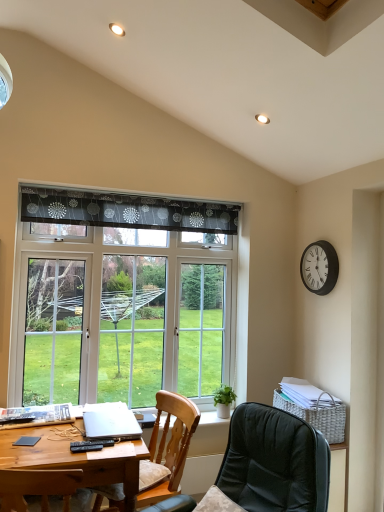
Question: Which direction should I rotate to look at leather-like black chair at lower center, placed as the 2th chair when sorted from back to front, — up or down?

Choices:
 (A) up
 (B) down

Answer: (B)

Question: Considering the relative sizes of transparent glass window at center and silver metallic laptop at lower left in the image provided, is transparent glass window at center bigger than silver metallic laptop at lower left?

Choices:
 (A) no
 (B) yes

Answer: (B)

Question: From the image's perspective, does transparent glass window at center appear lower than silver metallic laptop at lower left?

Choices:
 (A) no
 (B) yes

Answer: (A)

Question: Would you say transparent glass window at center is a long distance from silver metallic laptop at lower left?

Choices:
 (A) no
 (B) yes

Answer: (A)

Question: Considering the relative sizes of transparent glass window at center and silver metallic laptop at lower left in the image provided, is transparent glass window at center smaller than silver metallic laptop at lower left?

Choices:
 (A) no
 (B) yes

Answer: (A)

Question: Can you confirm if transparent glass window at center is positioned to the left of silver metallic laptop at lower left?

Choices:
 (A) yes
 (B) no

Answer: (B)

Question: Is transparent glass window at center wider than silver metallic laptop at lower left?

Choices:
 (A) no
 (B) yes

Answer: (A)

Question: Would you say black metal clock at upper right contains black plastic remote control at lower left, arranged as the 1th remote control when viewed from the left?

Choices:
 (A) yes
 (B) no

Answer: (B)

Question: Does black metal clock at upper right have a greater height compared to black plastic remote control at lower left, the second remote control in the front-to-back sequence?

Choices:
 (A) yes
 (B) no

Answer: (A)

Question: Is black metal clock at upper right facing away from black plastic remote control at lower left, which is the 1th remote control from back to front?

Choices:
 (A) yes
 (B) no

Answer: (B)

Question: Considering the relative sizes of black metal clock at upper right and black plastic remote control at lower left, arranged as the 1th remote control when viewed from the left, in the image provided, is black metal clock at upper right wider than black plastic remote control at lower left, arranged as the 1th remote control when viewed from the left,?

Choices:
 (A) no
 (B) yes

Answer: (A)

Question: Does black metal clock at upper right have a lesser width compared to black plastic remote control at lower left, which is the 1th remote control from back to front?

Choices:
 (A) no
 (B) yes

Answer: (B)

Question: Is black metal clock at upper right located outside black plastic remote control at lower left, which is the 1th remote control from back to front?

Choices:
 (A) yes
 (B) no

Answer: (A)

Question: Considering the relative sizes of transparent glass window at center and leather-like black chair at lower center, placed as the 2th chair when sorted from back to front, in the image provided, is transparent glass window at center thinner than leather-like black chair at lower center, placed as the 2th chair when sorted from back to front,?

Choices:
 (A) yes
 (B) no

Answer: (A)